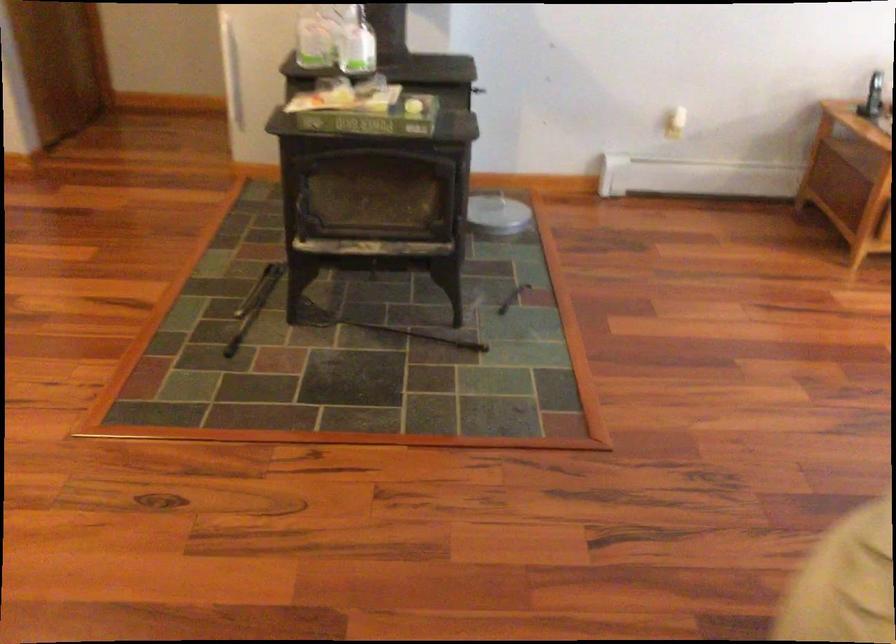
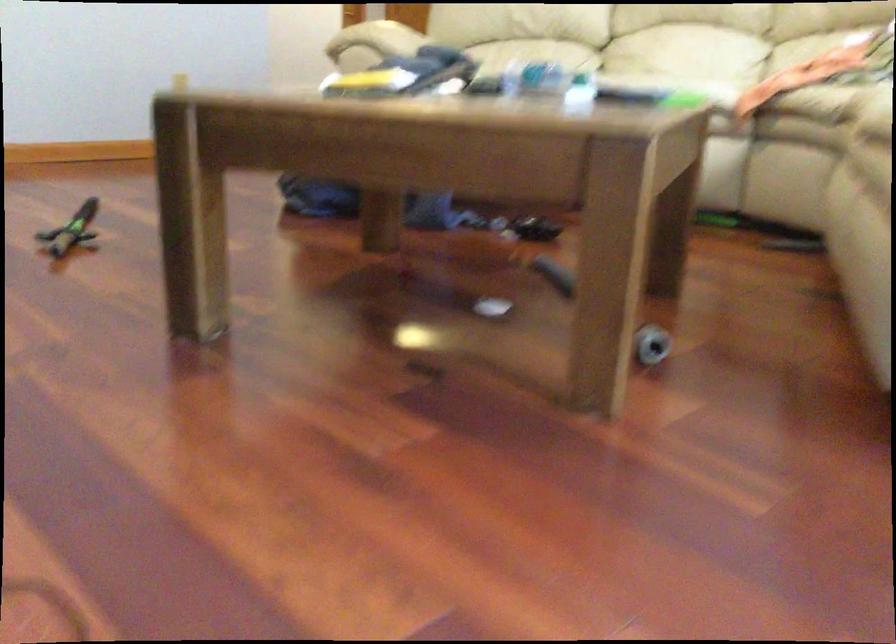
Question: I am providing you with two images of the same scene from different viewpoints. After the viewpoint changes to image2, which objects are now occluded?

Choices:
 (A) sofa armrest
 (B) stove door handle
 (C) telephone keypad
 (D) sofa sitting surface

Answer: (B)